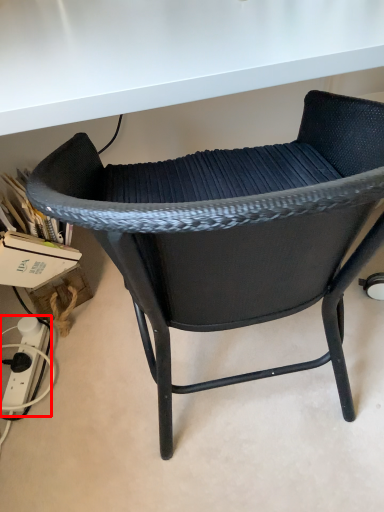
Question: From the image's perspective, what is the correct spatial relationship of plug (annotated by the red box) in relation to chair?

Choices:
 (A) above
 (B) below

Answer: (B)